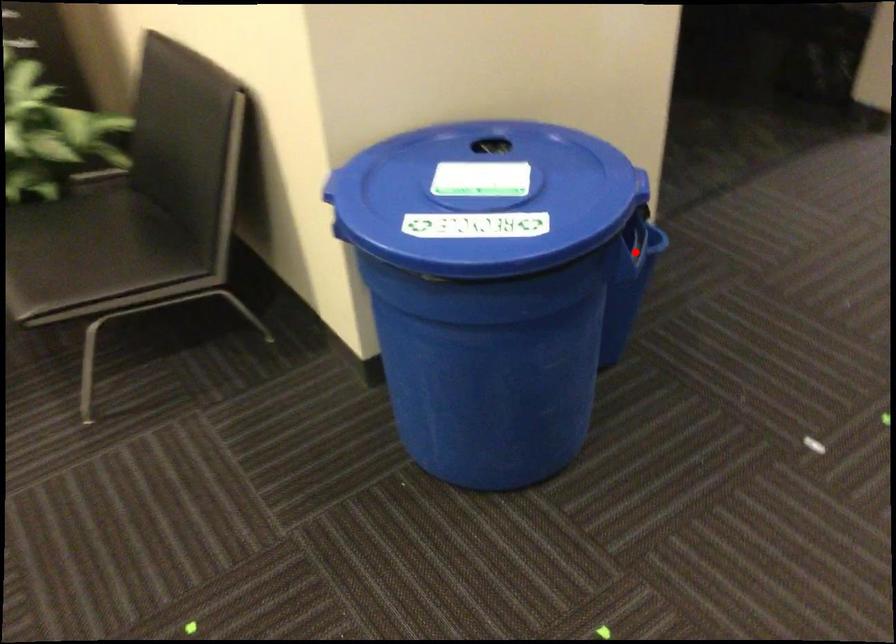
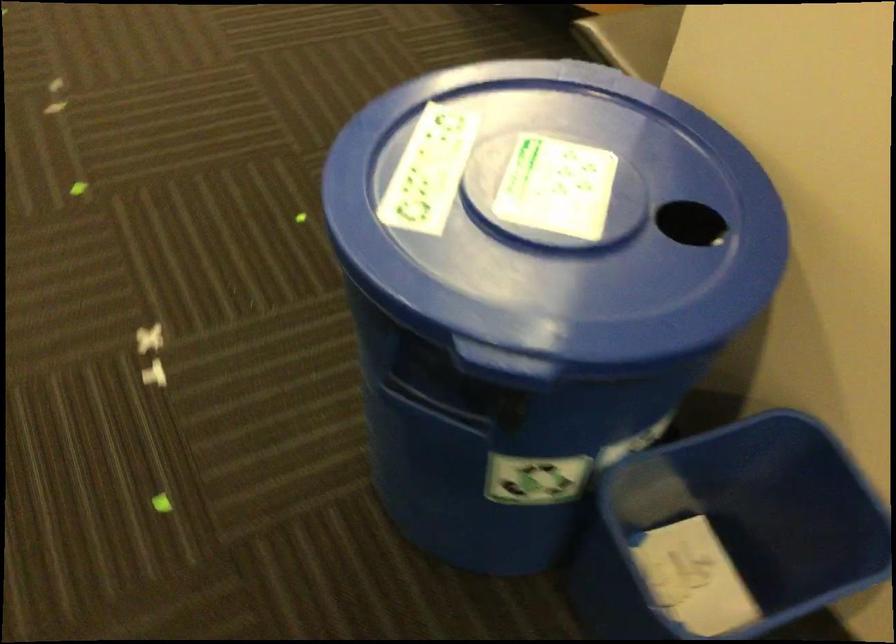
Question: I am providing you with two images of the same scene from different viewpoints. In image1, a red point is highlighted. Considering the same 3D point in image2, which of the following is correct?

Choices:
 (A) It is closer
 (B) It is farther

Answer: (A)